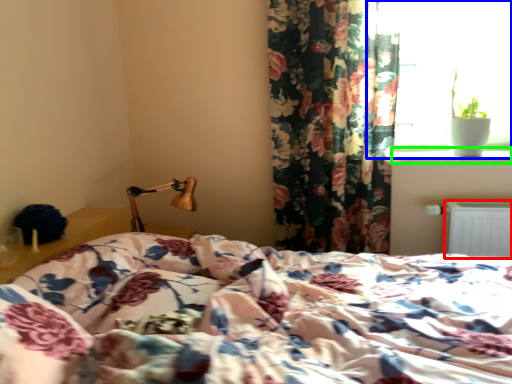
Question: Based on their relative distances, which object is farther from radiator (highlighted by a red box)? Choose from window (highlighted by a blue box) and window sill (highlighted by a green box).

Choices:
 (A) window
 (B) window sill

Answer: (A)